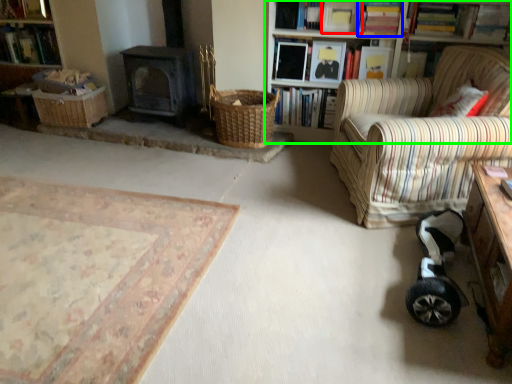
Question: Which object is the closest to the book (highlighted by a red box)? Choose among these: book (highlighted by a blue box) or bookcase (highlighted by a green box).

Choices:
 (A) book
 (B) bookcase

Answer: (A)